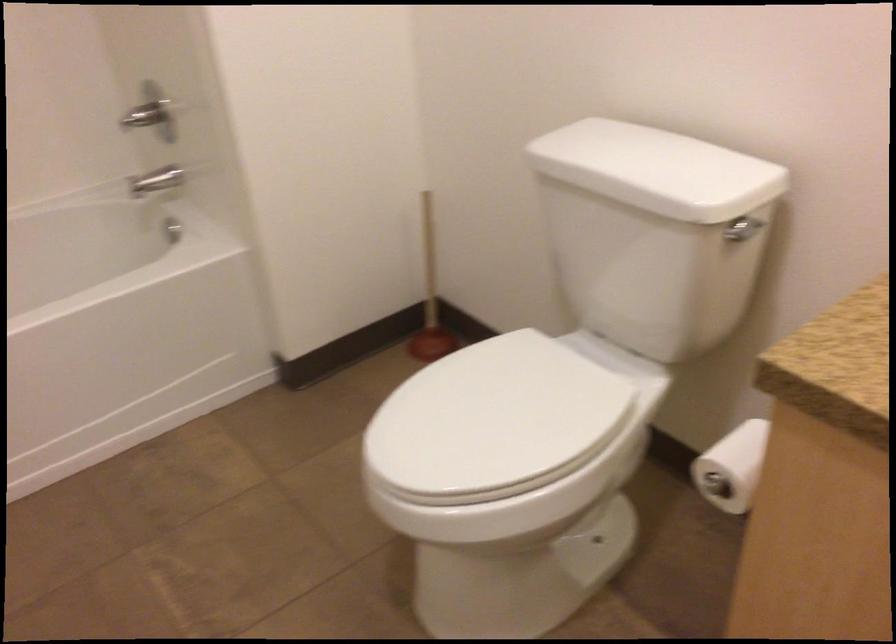
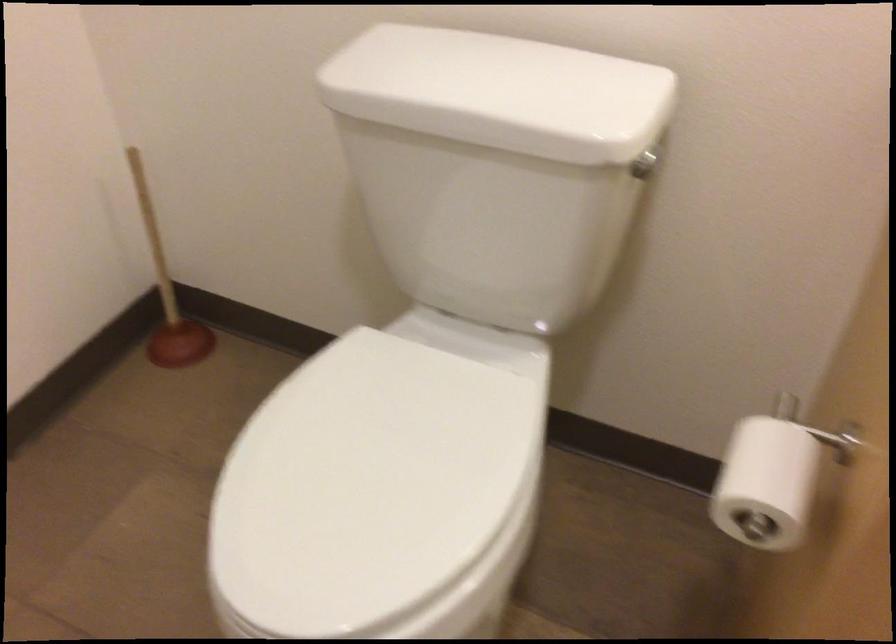
Find the pixel in the second image that matches the point at 745,468 in the first image.

(765, 484)